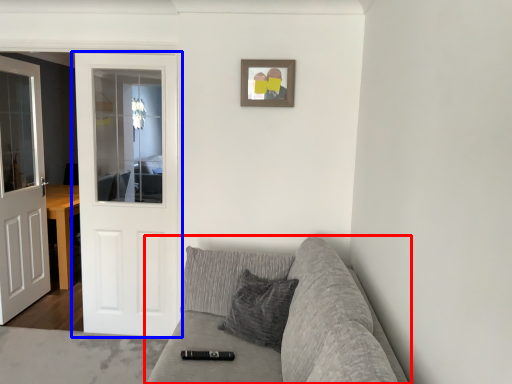
Question: Which point is further to the camera, studio couch (highlighted by a red box) or door (highlighted by a blue box)?

Choices:
 (A) studio couch
 (B) door

Answer: (B)